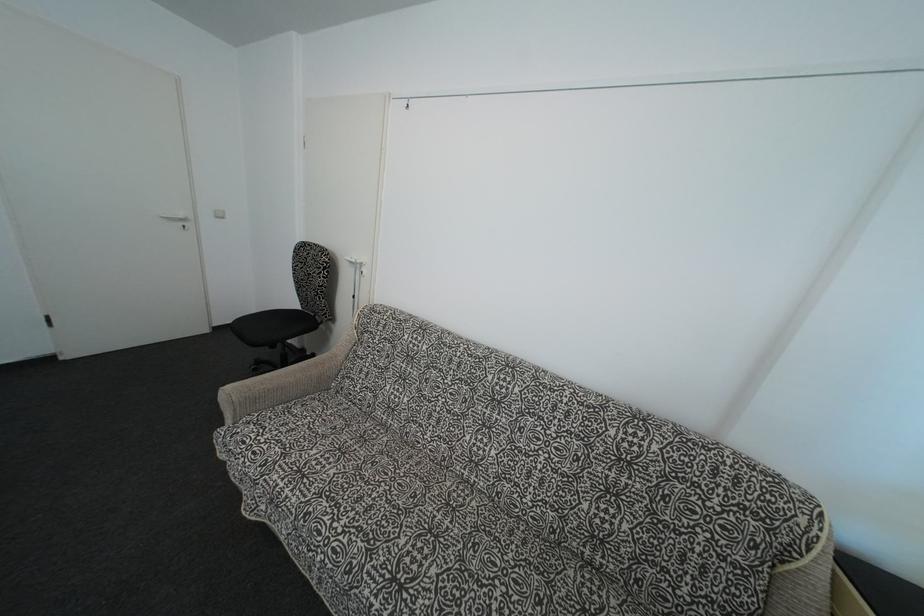
Locate an element on the screen. sofa armrest is located at coordinates (276, 387).